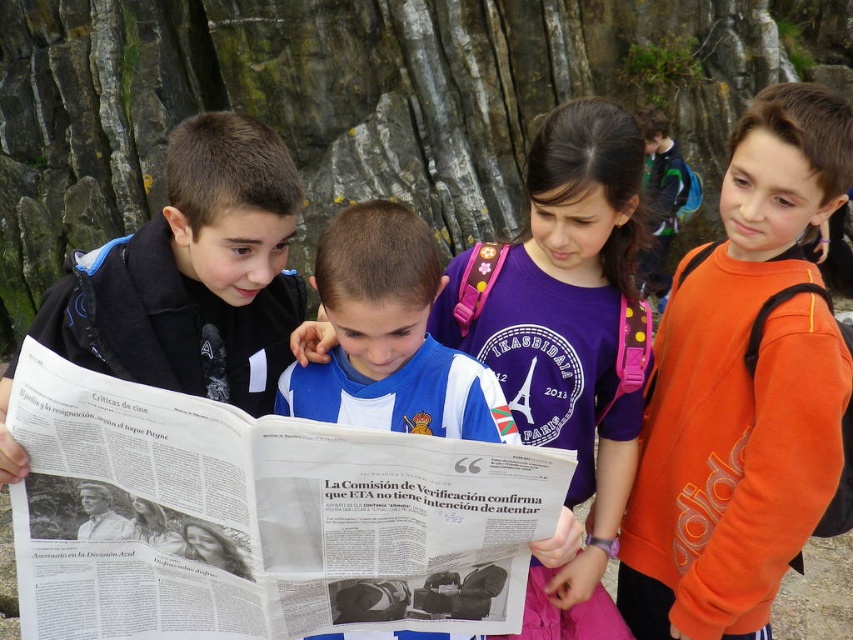
Based on the scene description, which child is wearing a taller garment between the orange fleece sweatshirt at right and the matte black jacket at center?

The orange fleece sweatshirt at right is much taller than the matte black jacket at center.

Consider the image. Based on the scene description, which child is positioned lower in the image between the orange fleece sweatshirt at right and the matte black jacket at center?

The orange fleece sweatshirt at right is positioned below the matte black jacket at center in the image.